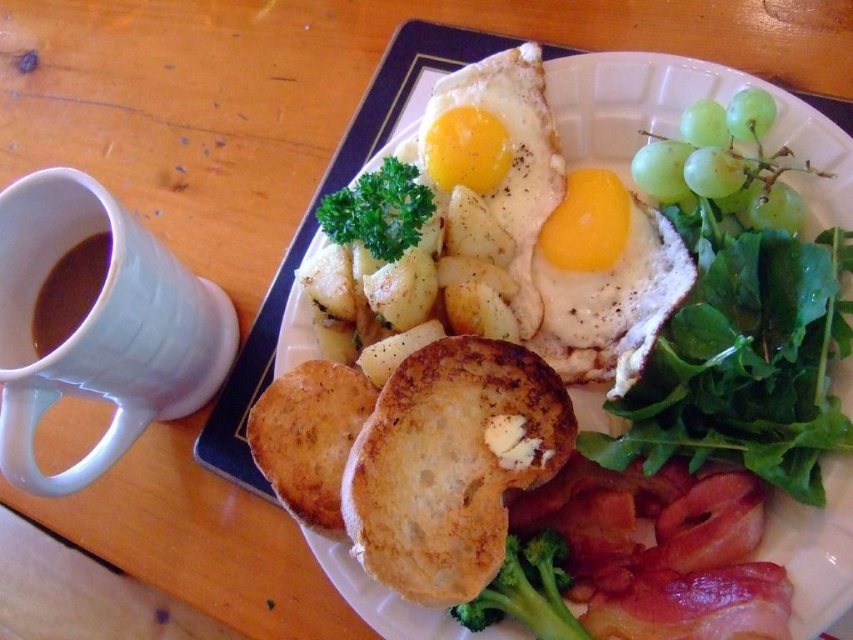
Question: Which of these objects is positioned closest to the white plate at center?

Choices:
 (A) green matte broccoli at center
 (B) golden fried egg at center
 (C) green shiny grapes at upper right

Answer: (C)

Question: In this image, where is green shiny grapes at upper right located relative to brown matte mug at upper left?

Choices:
 (A) below
 (B) above

Answer: (B)

Question: Is white plate at center bigger than white ceramic mug at left?

Choices:
 (A) no
 (B) yes

Answer: (B)

Question: Which of the following is the farthest from the observer?

Choices:
 (A) (637, 237)
 (B) (404, 131)

Answer: (B)

Question: Estimate the real-world distances between objects in this image. Which object is closer to the brown matte mug at upper left?

Choices:
 (A) golden fried egg at center
 (B) yellow/yolkish fried egg at center

Answer: (A)

Question: Can you confirm if white ceramic mug at left is bigger than brown matte mug at upper left?

Choices:
 (A) yes
 (B) no

Answer: (A)